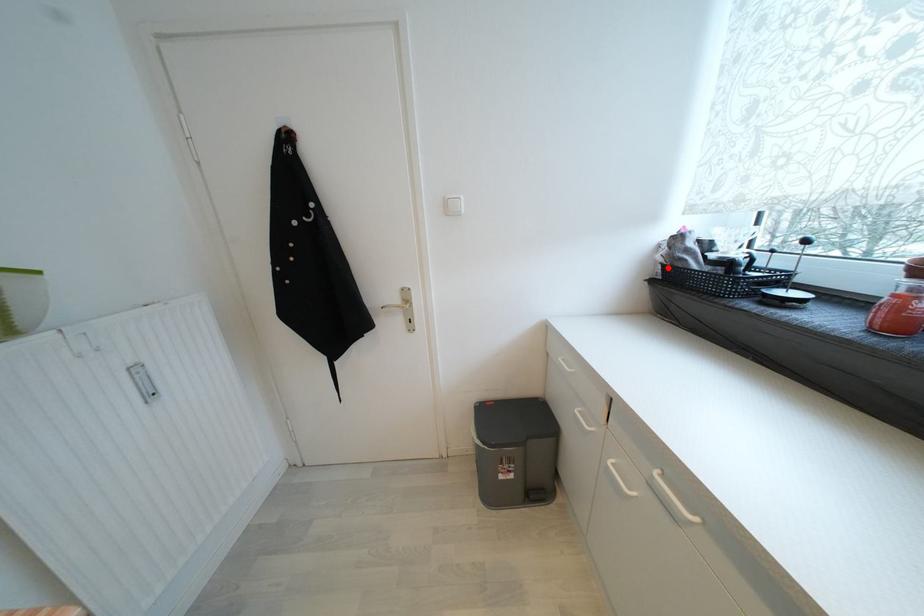
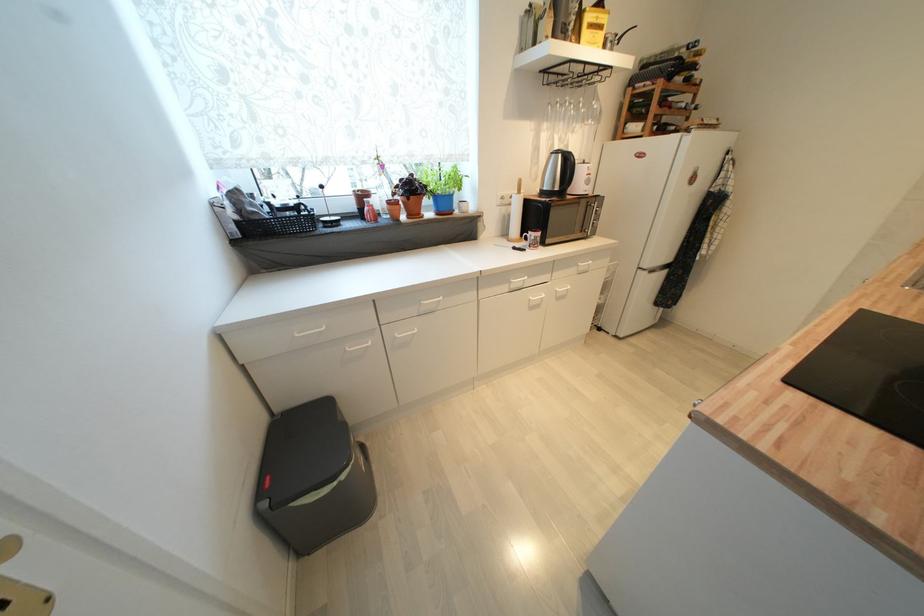
Find the pixel in the second image that matches the highlighted location in the first image.

(242, 225)